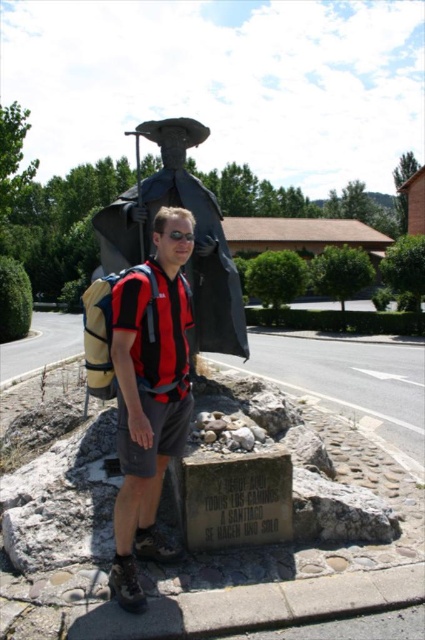
Does point (130, 540) come behind point (200, 196)?

No, (130, 540) is closer to viewer.

This screenshot has height=640, width=425. Describe the element at coordinates (150, 397) in the screenshot. I see `red and black striped shirt at center` at that location.

Does point (172, 448) come closer to viewer compared to point (223, 264)?

That is True.

Identify the location of red and black striped shirt at center. (150, 397).

Does black matte statue at upper center have a smaller size compared to black plastic goggles at center?

Incorrect, black matte statue at upper center is not smaller in size than black plastic goggles at center.

Is point (149, 196) positioned after point (178, 237)?

That is True.

Find the location of a particular element. The width and height of the screenshot is (425, 640). black matte statue at upper center is located at coordinates tap(195, 237).

Can you confirm if red and black striped shirt at center is wider than black plastic goggles at center?

Correct, the width of red and black striped shirt at center exceeds that of black plastic goggles at center.

Between point (124, 442) and point (181, 237), which one is positioned in front?

Point (124, 442) is in front.

This screenshot has width=425, height=640. In order to click on red and black striped shirt at center in this screenshot , I will do `click(150, 397)`.